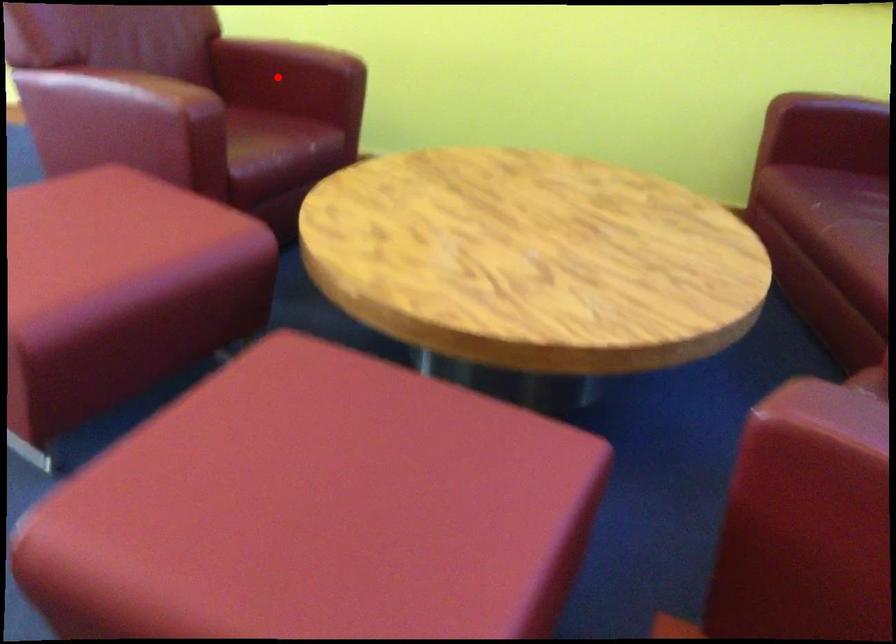
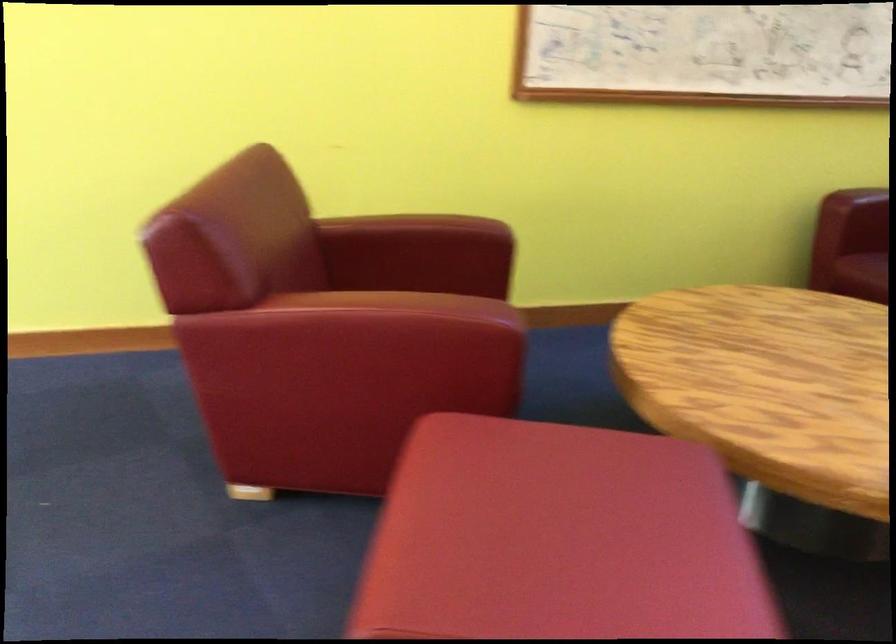
In the second image, find the point that corresponds to the highlighted location in the first image.

(418, 254)